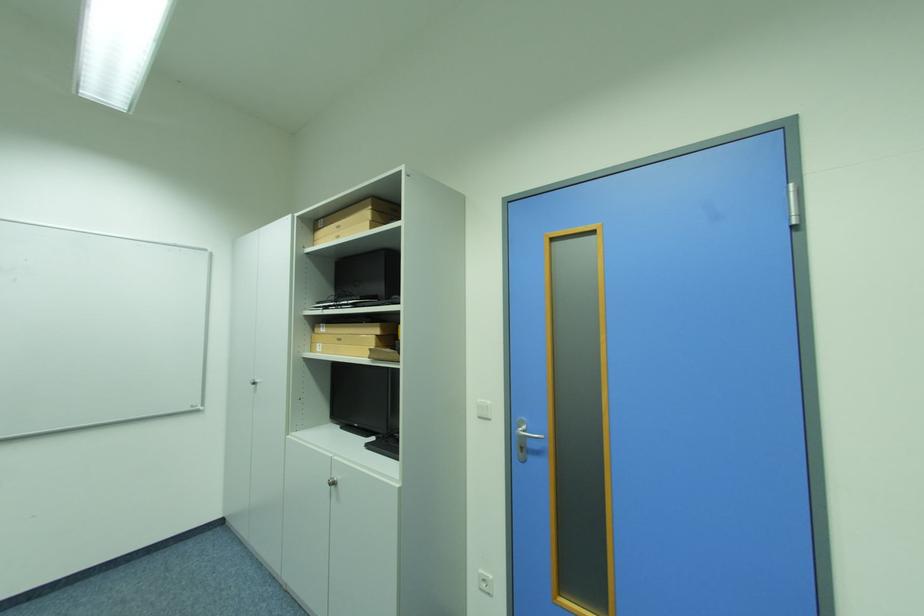
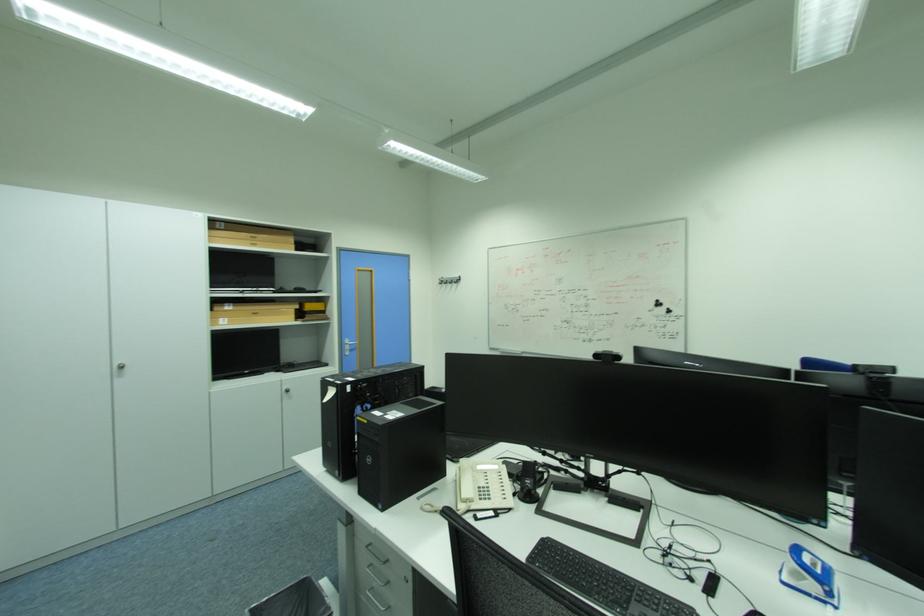
Locate, in the second image, the point that corresponds to point 325,345 in the first image.

(228, 320)